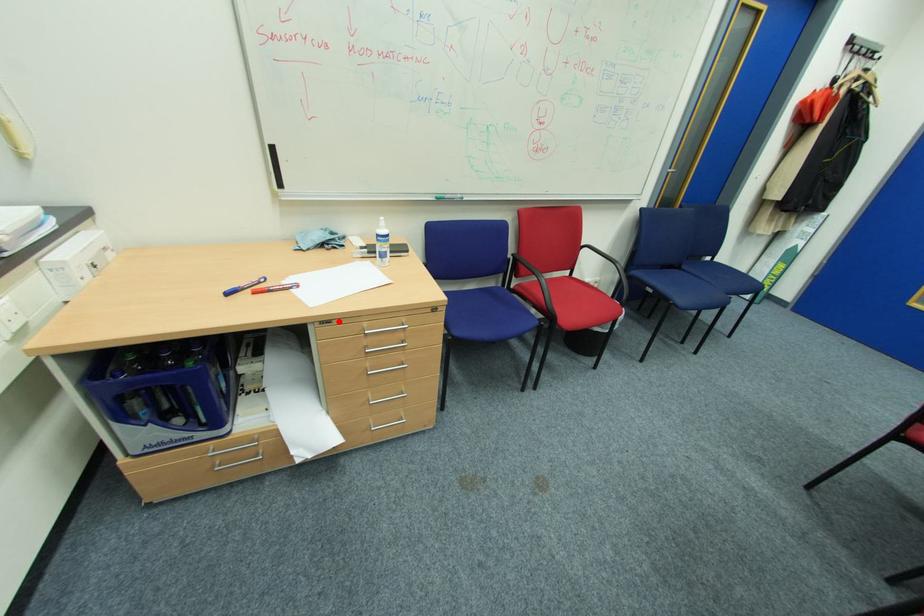
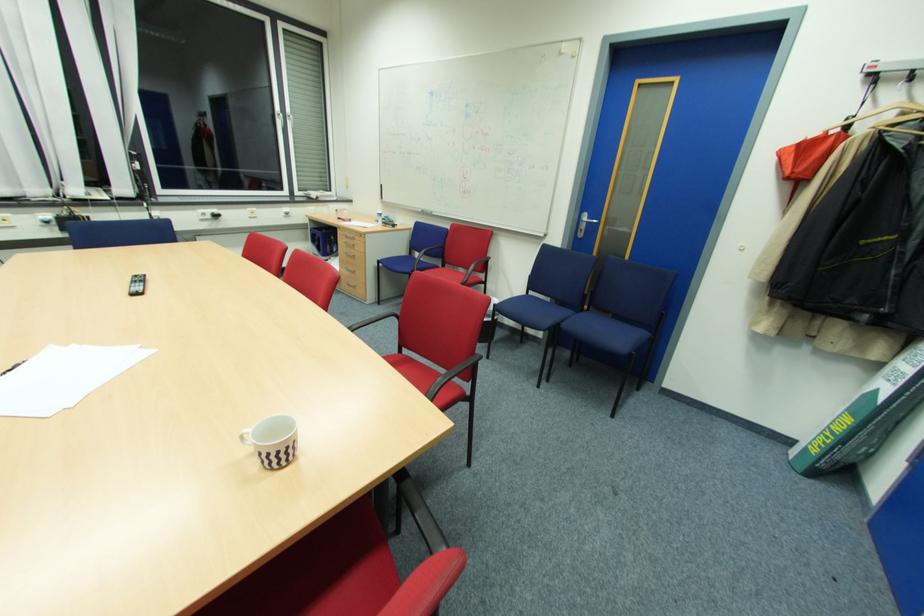
In the second image, find the point that corresponds to the highlighted location in the first image.

(344, 229)